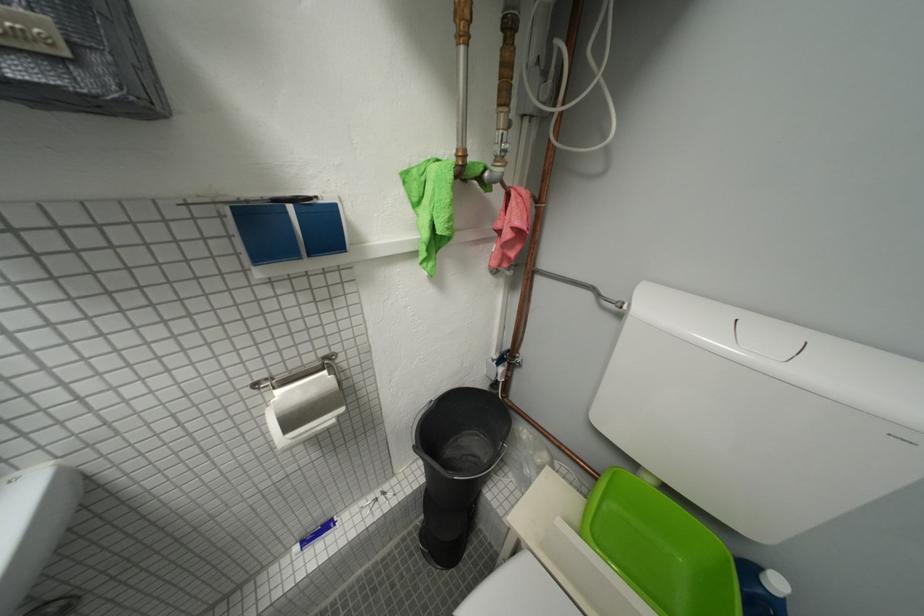
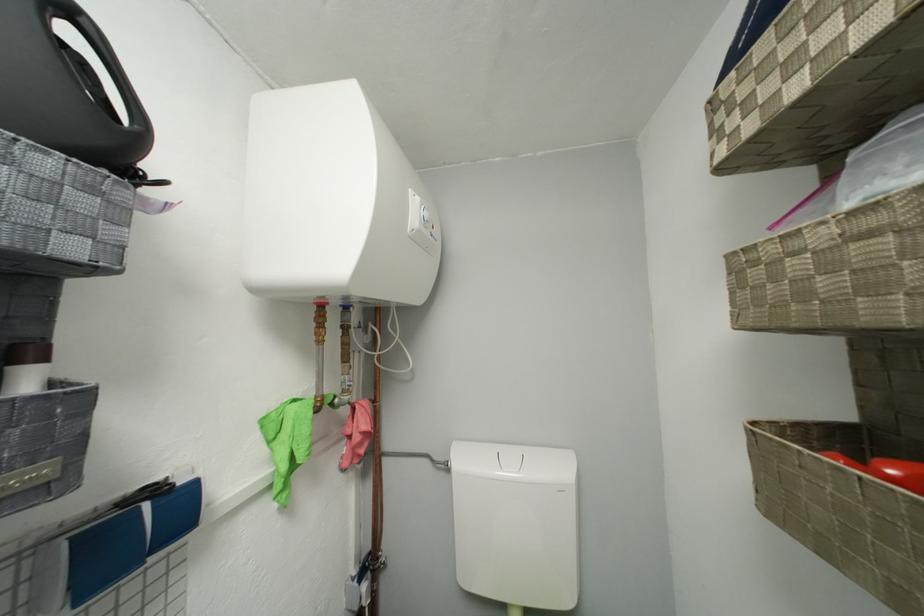
The point at (75, 55) is marked in the first image. Where is the corresponding point in the second image?

(66, 477)